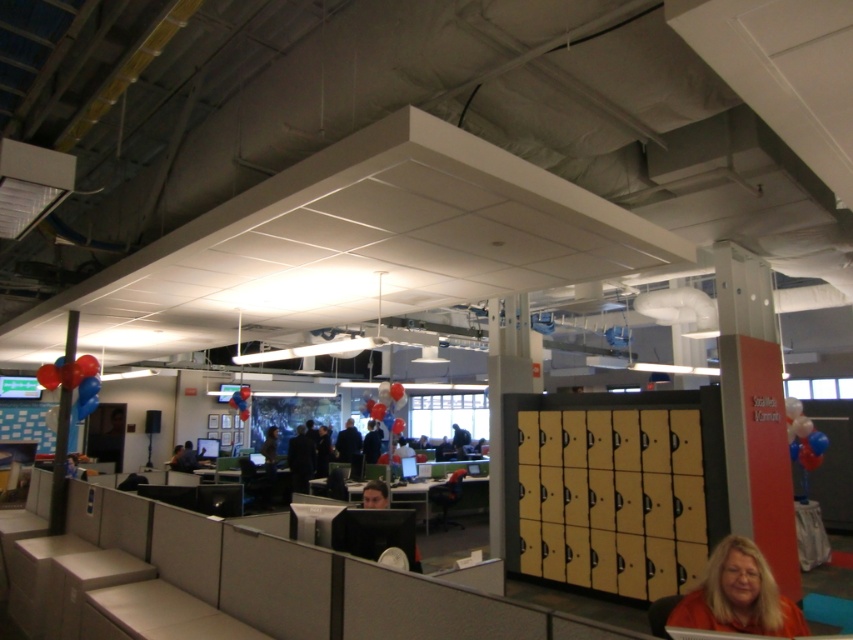
Question: Can you confirm if shiny metallic balloons at left is positioned below matte black monitor at center?

Choices:
 (A) no
 (B) yes

Answer: (A)

Question: Among these objects, which one is nearest to the camera?

Choices:
 (A) matte black monitor at center
 (B) shiny metallic balloons at left
 (C) dark brown leather jacket at center

Answer: (A)

Question: Which point is farther to the camera?

Choices:
 (A) (273, 445)
 (B) (234, 396)

Answer: (B)

Question: Is translucent blue balloon at right smaller than dark brown leather jacket at center?

Choices:
 (A) no
 (B) yes

Answer: (A)

Question: Is matte black monitor at center closer to camera compared to red glossy balloon at center?

Choices:
 (A) no
 (B) yes

Answer: (B)

Question: Estimate the real-world distances between objects in this image. Which object is closer to the translucent blue balloon at right?

Choices:
 (A) matte black monitor at center
 (B) matte black desk at center
 (C) red glossy balloon at center

Answer: (B)